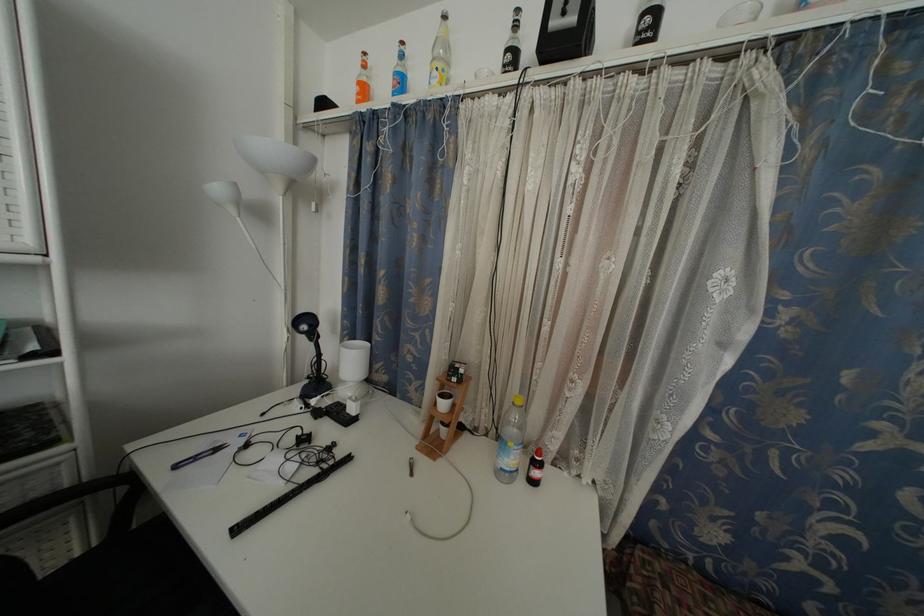
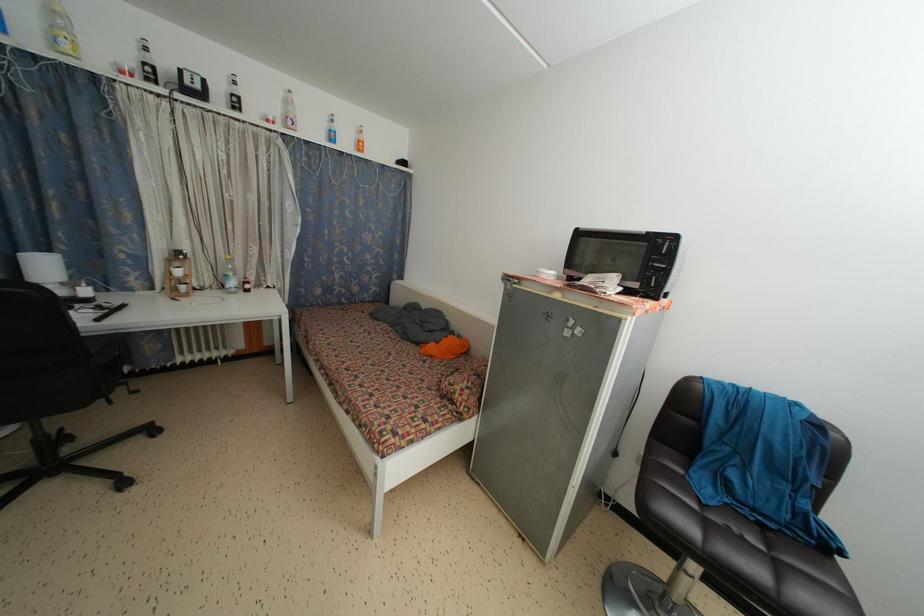
Find the pixel in the second image that matches point 651,26 in the first image.

(238, 105)